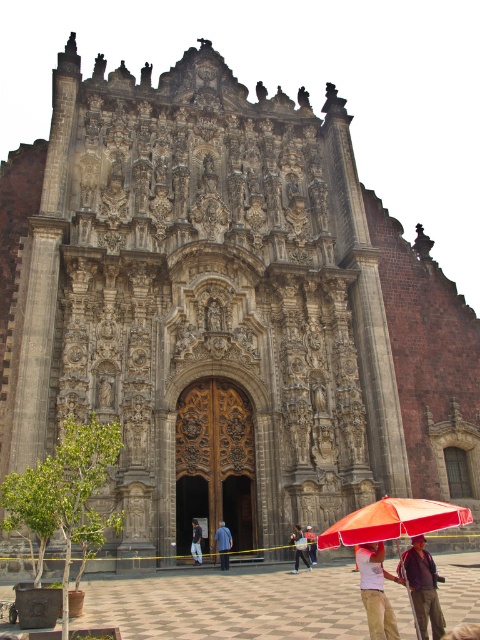
You are standing in front of the historic building and notice an object at the lower center. What is the exact location of the tan cotton shorts at lower center in the image?

The tan cotton shorts at lower center is located at point (375, 592).

You are standing in front of the historic building and notice an orange fabric umbrella at lower center and tan cotton shorts at lower center. Which object is positioned lower in the image?

The orange fabric umbrella at lower center is located below tan cotton shorts at lower center, so it is positioned lower in the image.

You are a photographer setting up a tripod in front of the historic building. You need to position it between the tan cotton shorts at lower center and the dark blue jeans at center. Which object should you place the tripod closer to if you want to ensure it doesn not block the view of the building s entrance?

The tan cotton shorts at lower center might be wider than dark blue jeans at center, so placing the tripod closer to the dark blue jeans at center would minimize the obstruction of the building s entrance view.